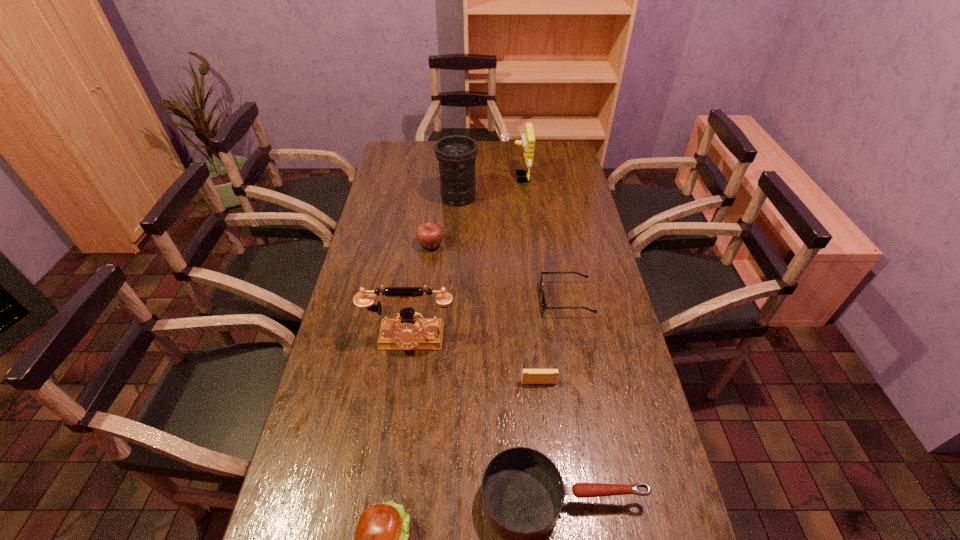
At what (x,y) coordinates should I click in order to perform the action: click on vacant space located on the dial of the fifth farthest object. Please return your answer as a coordinate pair (x, y). Image resolution: width=960 pixels, height=540 pixels. Looking at the image, I should click on (390, 476).

You are a GUI agent. You are given a task and a screenshot of the screen. Output one action in this format:
    pyautogui.click(x=<x>, y=<y>)
    Task: Click on the blank space located on the side of the apple with the unique marking
    
    Given the screenshot: What is the action you would take?
    pyautogui.click(x=536, y=245)

This screenshot has height=540, width=960. Identify the location of vacant space located 0.280m at the front of the videotape with spools. (551, 491).

Locate an element on the screen. This screenshot has height=540, width=960. free region located 0.150m on the front lenses of the sunglasses is located at coordinates (495, 299).

At what (x,y) coordinates should I click in order to perform the action: click on free space located on the front lenses of the sunglasses. Please return your answer as a coordinate pair (x, y). Looking at the image, I should click on (490, 299).

Find the location of a particular element. vacant region located 0.180m on the front lenses of the sunglasses is located at coordinates (486, 299).

Locate an element on the screen. The height and width of the screenshot is (540, 960). object located at the left edge is located at coordinates point(406,333).

The width and height of the screenshot is (960, 540). Identify the location of object that is positioned at the right edge. (544, 305).

In the image, there is a desktop. Where is `free space at the far edge`? free space at the far edge is located at coordinates (483, 159).

At what (x,y) coordinates should I click in order to perform the action: click on vacant point at the right edge. Please return your answer as a coordinate pair (x, y). Looking at the image, I should click on (588, 248).